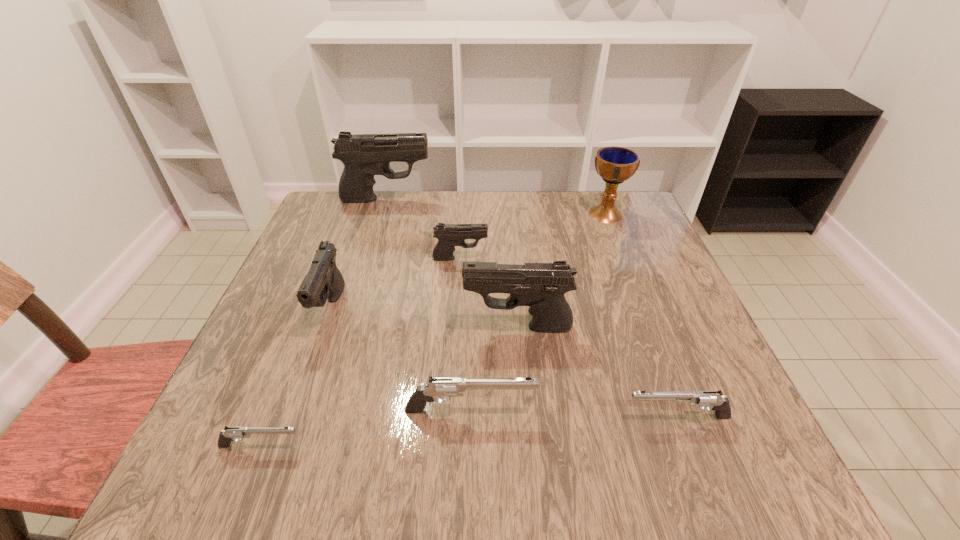
At what (x,y) coordinates should I click in order to perform the action: click on vacant space located on the front-facing side of the second silver pistol from left to right. Please return your answer as a coordinate pair (x, y). The width and height of the screenshot is (960, 540). Looking at the image, I should click on pos(673,410).

Locate an element on the screen. The height and width of the screenshot is (540, 960). free space located on the front-facing side of the sixth tallest pistol is located at coordinates (444, 417).

Find the location of a particular element. vacant space located on the front-facing side of the sixth tallest pistol is located at coordinates (421, 417).

This screenshot has width=960, height=540. What are the coordinates of `free location located on the front-facing side of the sixth tallest pistol` in the screenshot? It's located at (421, 417).

Find the location of a particular element. The image size is (960, 540). vacant space located on the front-facing side of the leftmost silver pistol is located at coordinates (499, 446).

The image size is (960, 540). Find the location of `pistol that is positioned at the far edge`. pistol that is positioned at the far edge is located at coordinates (364, 155).

At what (x,y) coordinates should I click in order to perform the action: click on chalice that is positioned at the far edge. Please return your answer as a coordinate pair (x, y). Looking at the image, I should click on (615, 165).

Where is `object present at the near edge`? object present at the near edge is located at coordinates (230, 434).

At what (x,y) coordinates should I click in order to perform the action: click on chalice at the right edge. Please return your answer as a coordinate pair (x, y). The width and height of the screenshot is (960, 540). Looking at the image, I should click on (615, 165).

The image size is (960, 540). Identify the location of pistol that is at the right edge. pyautogui.click(x=713, y=399).